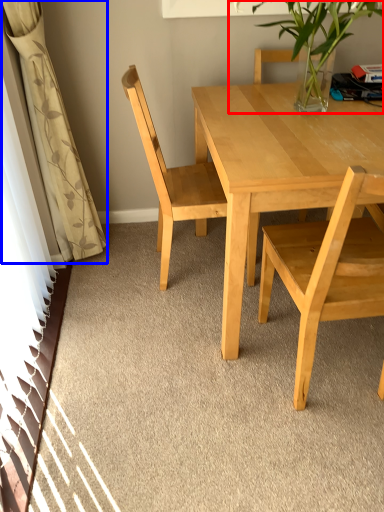
Question: Which point is further to the camera, houseplant (highlighted by a red box) or curtain (highlighted by a blue box)?

Choices:
 (A) houseplant
 (B) curtain

Answer: (B)